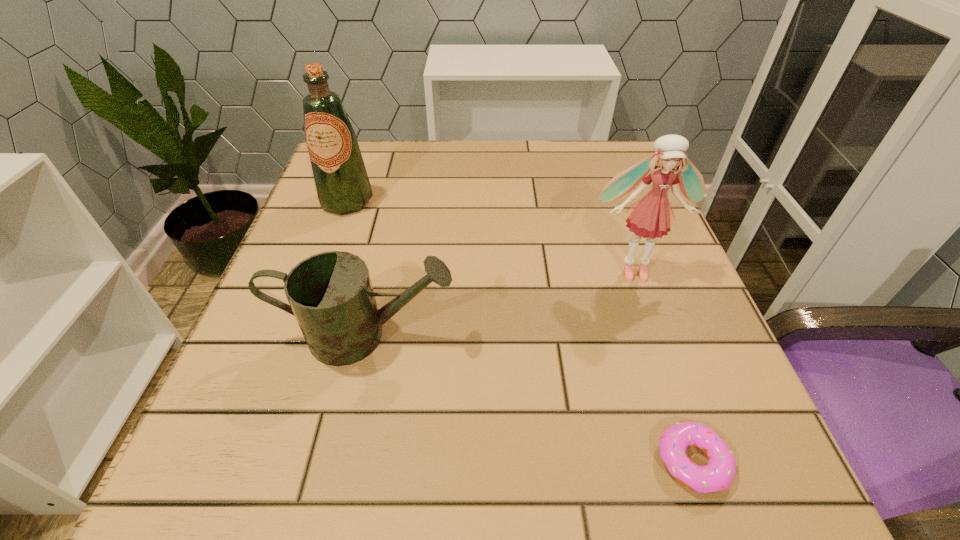
The height and width of the screenshot is (540, 960). In the image, there is a desktop. Find the location of `free space at the right edge`. free space at the right edge is located at coordinates (640, 348).

Identify the location of vacant region at the far left corner of the desktop. The width and height of the screenshot is (960, 540). (366, 150).

Find the location of a particular element. This screenshot has width=960, height=540. vacant position at the far right corner of the desktop is located at coordinates (593, 140).

Where is `vacant area that lies between the third tallest object and the doll`? The width and height of the screenshot is (960, 540). vacant area that lies between the third tallest object and the doll is located at coordinates (499, 303).

The width and height of the screenshot is (960, 540). I want to click on empty space between the doughnut and the doll, so click(662, 366).

This screenshot has height=540, width=960. Find the location of `vacant space that's between the doll and the third farthest object`. vacant space that's between the doll and the third farthest object is located at coordinates (499, 303).

This screenshot has width=960, height=540. What are the coordinates of `empty space between the watering can and the doll` in the screenshot? It's located at (499, 303).

This screenshot has width=960, height=540. I want to click on empty location between the second shortest object and the third nearest object, so click(x=499, y=303).

Where is `free spot between the shortest object and the third farthest object`? The image size is (960, 540). free spot between the shortest object and the third farthest object is located at coordinates (529, 399).

Image resolution: width=960 pixels, height=540 pixels. Identify the location of vacant space that's between the farthest object and the second farthest object. (490, 235).